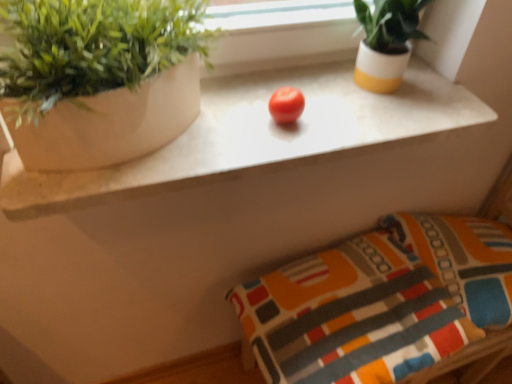
Image resolution: width=512 pixels, height=384 pixels. Identify the location of vacant area that lies to the right of matte white pot at upper left. [x=267, y=109].